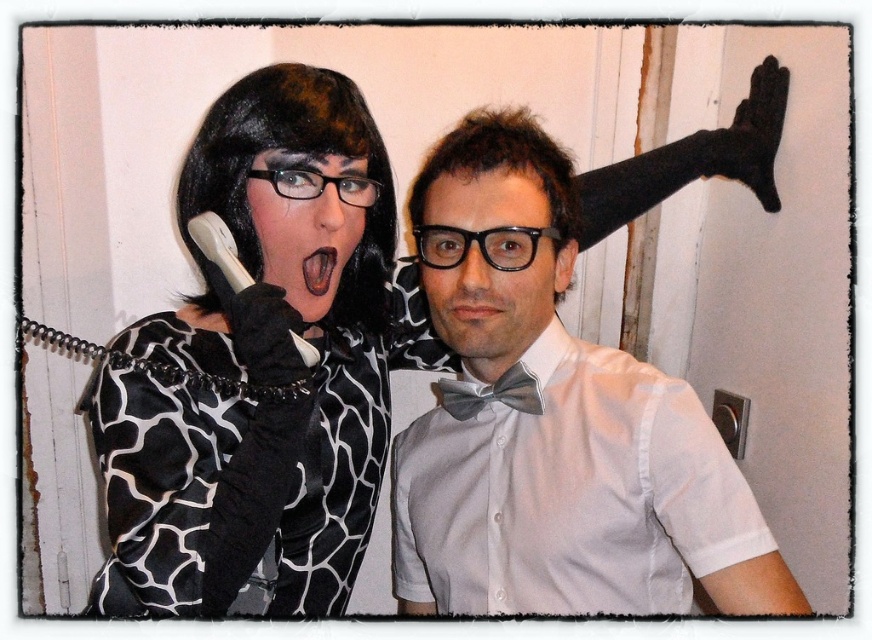
Question: Considering the relative positions of matte black wig at upper left and black matte tongue at center in the image provided, where is matte black wig at upper left located with respect to black matte tongue at center?

Choices:
 (A) right
 (B) left

Answer: (B)

Question: From the image, what is the correct spatial relationship of matte black wig at upper left in relation to black matte tongue at center?

Choices:
 (A) right
 (B) left

Answer: (B)

Question: Based on their relative distances, which object is farther from the white matte bow tie at upper right?

Choices:
 (A) gray satin bow tie at center
 (B) black matte tongue at center

Answer: (B)

Question: Which object is the farthest from the black matte tongue at center?

Choices:
 (A) gray satin bow tie at center
 (B) matte black wig at upper left
 (C) white matte bow tie at upper right

Answer: (C)

Question: Which object appears farthest from the camera in this image?

Choices:
 (A) white matte bow tie at upper right
 (B) black matte tongue at center
 (C) matte black wig at upper left

Answer: (B)

Question: Is white matte bow tie at upper right positioned behind black matte tongue at center?

Choices:
 (A) yes
 (B) no

Answer: (B)